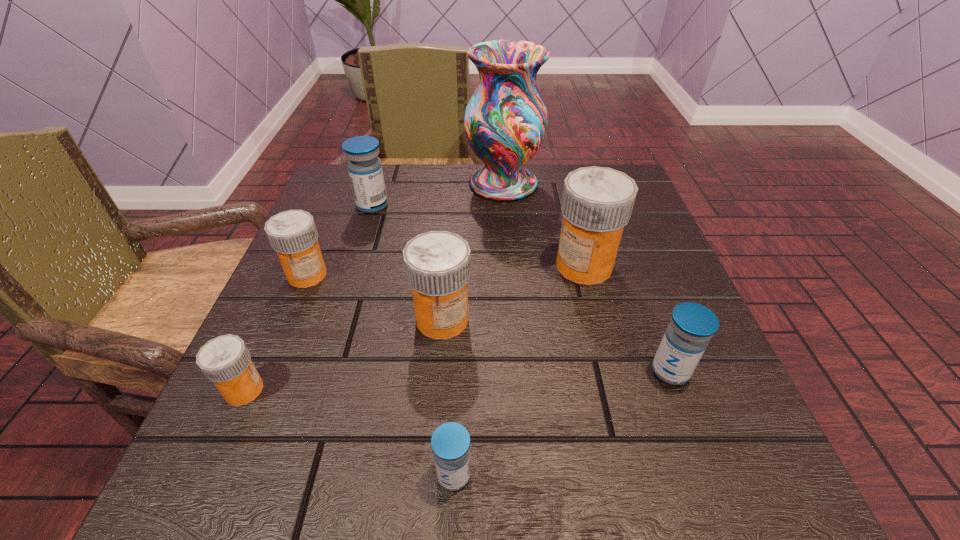
You are a GUI agent. You are given a task and a screenshot of the screen. Output one action in this format:
    pyautogui.click(x=<x>, y=<y>)
    Task: Click on the vacant space at the right edge
    This screenshot has height=540, width=960.
    Given the screenshot: What is the action you would take?
    pyautogui.click(x=611, y=322)

Locate an element on the screen. This screenshot has width=960, height=540. free location at the far left corner of the desktop is located at coordinates (348, 211).

The width and height of the screenshot is (960, 540). Find the location of `vacant space at the near left corner`. vacant space at the near left corner is located at coordinates (185, 480).

In the image, there is a desktop. At what (x,y) coordinates should I click in order to perform the action: click on vacant region at the near right corner. Please return your answer as a coordinate pair (x, y). This screenshot has width=960, height=540. Looking at the image, I should click on (698, 478).

The width and height of the screenshot is (960, 540). What are the coordinates of `free space between the rightmost medicine and the biggest orange medicine` in the screenshot? It's located at (627, 319).

The width and height of the screenshot is (960, 540). I want to click on vacant space that's between the nearest medicine and the third biggest orange medicine, so click(x=380, y=375).

The height and width of the screenshot is (540, 960). Find the location of `unoccupied position between the second orange medicine from right to left and the smallest orange medicine`. unoccupied position between the second orange medicine from right to left and the smallest orange medicine is located at coordinates (344, 355).

In order to click on free space between the tallest object and the third smallest orange medicine in this screenshot , I will do `click(473, 251)`.

Find the location of a particular element. This screenshot has width=960, height=540. free spot between the third farthest orange medicine and the biggest orange medicine is located at coordinates (514, 293).

Find the location of a particular element. The height and width of the screenshot is (540, 960). vacant point located between the vase and the fifth medicine from right to left is located at coordinates (438, 194).